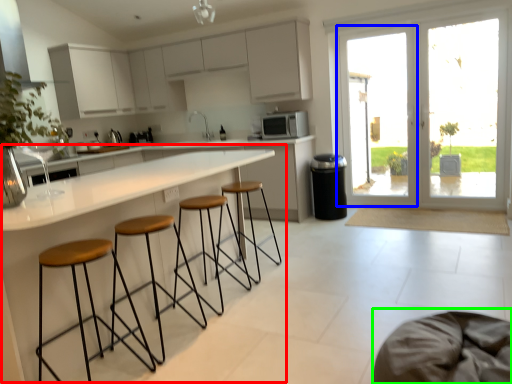
Question: Considering the real-world distances, which object is closest to round table (highlighted by a red box)? screen door (highlighted by a blue box) or swivel chair (highlighted by a green box).

Choices:
 (A) screen door
 (B) swivel chair

Answer: (B)